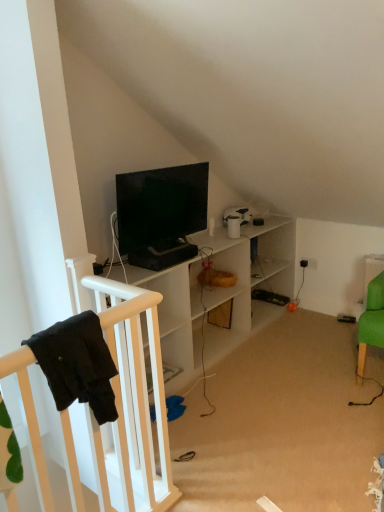
Question: Which is correct: black fabric infant bed at left is inside matte black tv at center, or outside of it?

Choices:
 (A) outside
 (B) inside

Answer: (A)

Question: Considering the relative positions of black fabric infant bed at left and matte black tv at center in the image provided, is black fabric infant bed at left to the left or to the right of matte black tv at center?

Choices:
 (A) right
 (B) left

Answer: (B)

Question: Considering the positions of black fabric infant bed at left and matte black tv at center in the image, is black fabric infant bed at left taller or shorter than matte black tv at center?

Choices:
 (A) short
 (B) tall

Answer: (A)

Question: Considering the positions of matte black tv at center and black fabric infant bed at left in the image, is matte black tv at center taller or shorter than black fabric infant bed at left?

Choices:
 (A) tall
 (B) short

Answer: (A)

Question: Is point click(145, 248) closer or farther from the camera than point click(165, 463)?

Choices:
 (A) closer
 (B) farther

Answer: (B)

Question: From a real-world perspective, is matte black tv at center physically located above or below black fabric infant bed at left?

Choices:
 (A) above
 (B) below

Answer: (A)

Question: Based on their positions, is matte black tv at center located to the left or right of black fabric infant bed at left?

Choices:
 (A) right
 (B) left

Answer: (A)